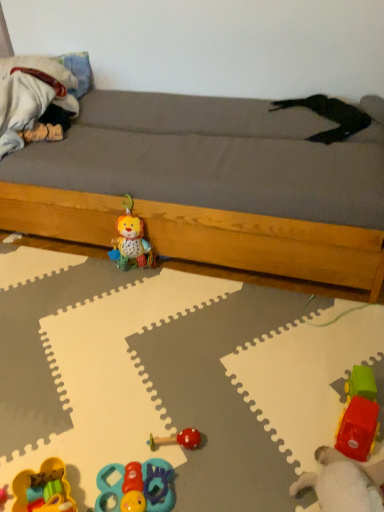
The image size is (384, 512). I want to click on empty space that is in between rubberized plastic truck at lower right, the 6th toy positioned from the left, and rubberized blue and red toy at lower center, arranged as the 4th toy when viewed from the right, so click(x=251, y=448).